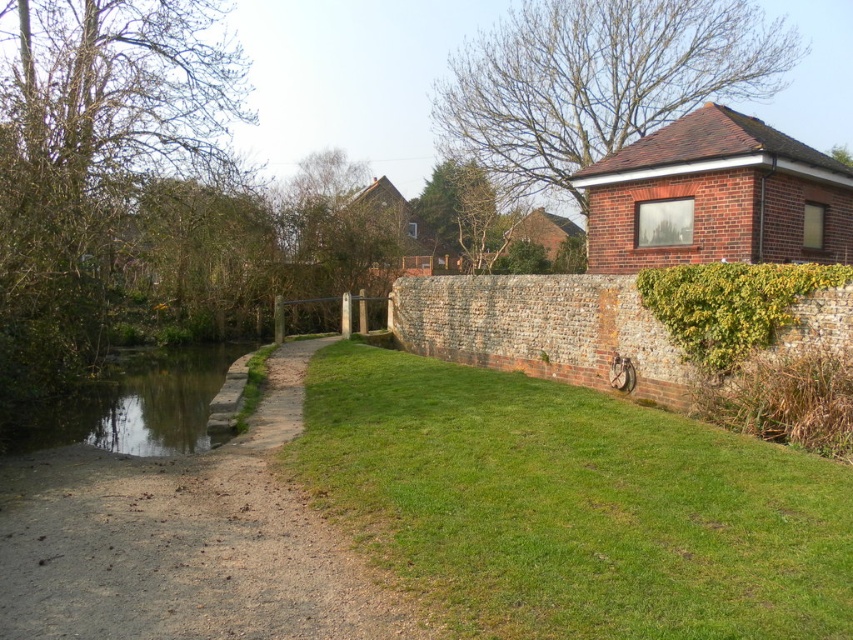
From the picture: Can you confirm if green grass at lower center is positioned to the left of dull brown gravel at center-left?

No, green grass at lower center is not to the left of dull brown gravel at center-left.

Is point (461, 593) positioned before point (299, 605)?

No, it is not.

Where is `green grass at lower center`? green grass at lower center is located at coordinates (570, 506).

Is point (105, 435) closer to viewer compared to point (685, 326)?

No, it is behind (685, 326).

Is greenish-brown concrete at left to the right of green leafy hedge at right from the viewer's perspective?

No, greenish-brown concrete at left is not to the right of green leafy hedge at right.

Does point (135, 435) come in front of point (762, 323)?

No, (135, 435) is behind (762, 323).

This screenshot has width=853, height=640. Find the location of `greenish-brown concrete at left`. greenish-brown concrete at left is located at coordinates (132, 404).

Can you confirm if dull brown gravel at center-left is smaller than greenish-brown concrete at left?

Yes, dull brown gravel at center-left is smaller than greenish-brown concrete at left.

Does point (171, 580) lie behind point (146, 436)?

No.

The height and width of the screenshot is (640, 853). What are the coordinates of `dull brown gravel at center-left` in the screenshot? It's located at (184, 541).